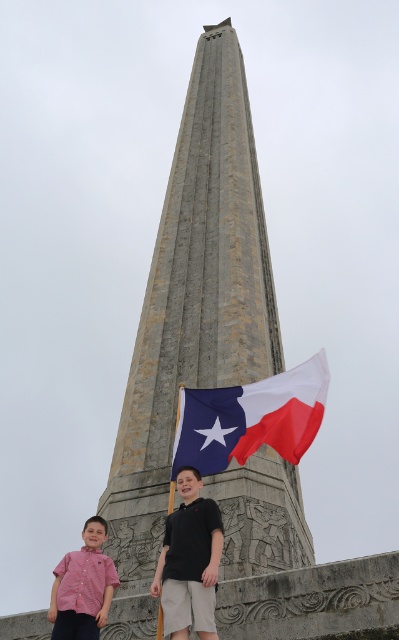
Question: Estimate the real-world distances between objects in this image. Which object is closer to the black cotton shirt at center?

Choices:
 (A) blue fabric texas flag at center
 (B) red checkered shirt at lower left
 (C) pink cotton shirt at lower left

Answer: (C)

Question: From the image, what is the correct spatial relationship of gray stone tower at center in relation to blue fabric texas flag at center?

Choices:
 (A) left
 (B) right

Answer: (A)

Question: Among these points, which one is nearest to the camera?

Choices:
 (A) (171, 563)
 (B) (92, 560)
 (C) (304, 518)
 (D) (189, 432)

Answer: (A)

Question: Can you confirm if blue fabric texas flag at center is bigger than black cotton shirt at center?

Choices:
 (A) no
 (B) yes

Answer: (B)

Question: Does gray stone tower at center lie behind red checkered shirt at lower left?

Choices:
 (A) no
 (B) yes

Answer: (A)

Question: Which point is farther to the camera?

Choices:
 (A) black cotton shirt at center
 (B) red checkered shirt at lower left

Answer: (A)